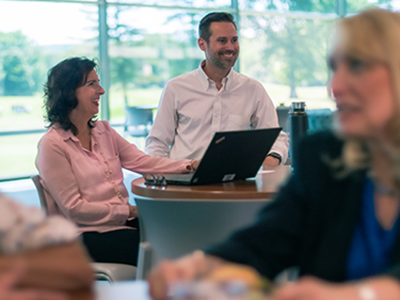
The height and width of the screenshot is (300, 400). Find the location of `laptop`. laptop is located at coordinates (223, 159).